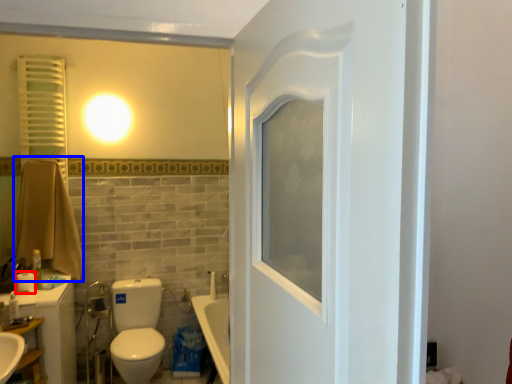
Question: Which of the following is the closest to the observer, toilet paper (highlighted by a red box) or bath towel (highlighted by a blue box)?

Choices:
 (A) toilet paper
 (B) bath towel

Answer: (A)